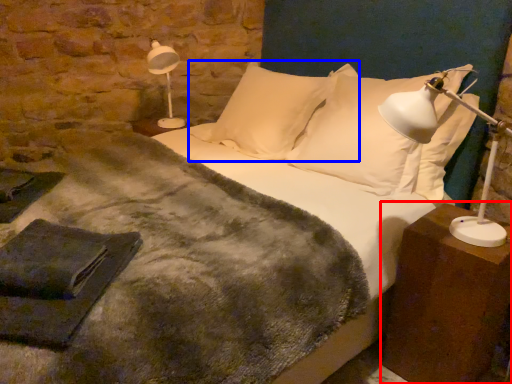
Question: Which object appears closest to the camera in this image, nightstand (highlighted by a red box) or pillow (highlighted by a blue box)?

Choices:
 (A) nightstand
 (B) pillow

Answer: (A)